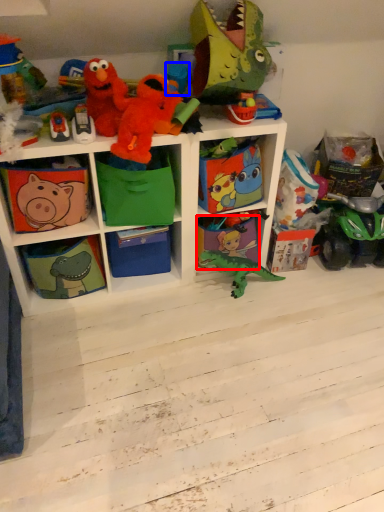
Question: Which of the following is the farthest to the observer, shelf (highlighted by a red box) or toy (highlighted by a blue box)?

Choices:
 (A) shelf
 (B) toy

Answer: (A)